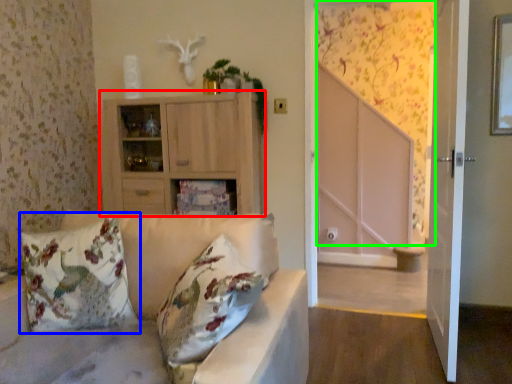
Question: Which is farther away from cabinetry (highlighted by a red box)? pillow (highlighted by a blue box) or curtain (highlighted by a green box)?

Choices:
 (A) pillow
 (B) curtain

Answer: (B)